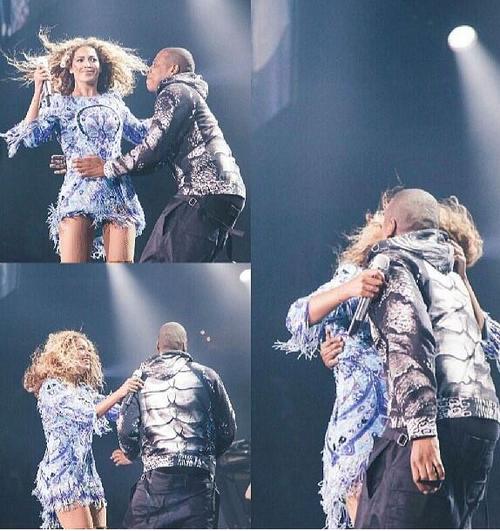
This screenshot has width=500, height=531. In order to click on stage light in this screenshot , I will do `click(129, 288)`, `click(472, 64)`, `click(225, 20)`.